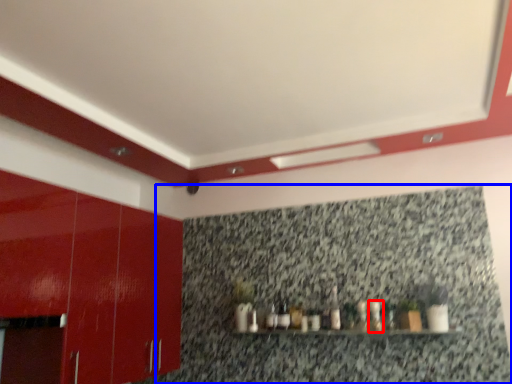
Question: Which object appears closest to the camera in this image, bottle (highlighted by a red box) or granite (highlighted by a blue box)?

Choices:
 (A) bottle
 (B) granite

Answer: (B)